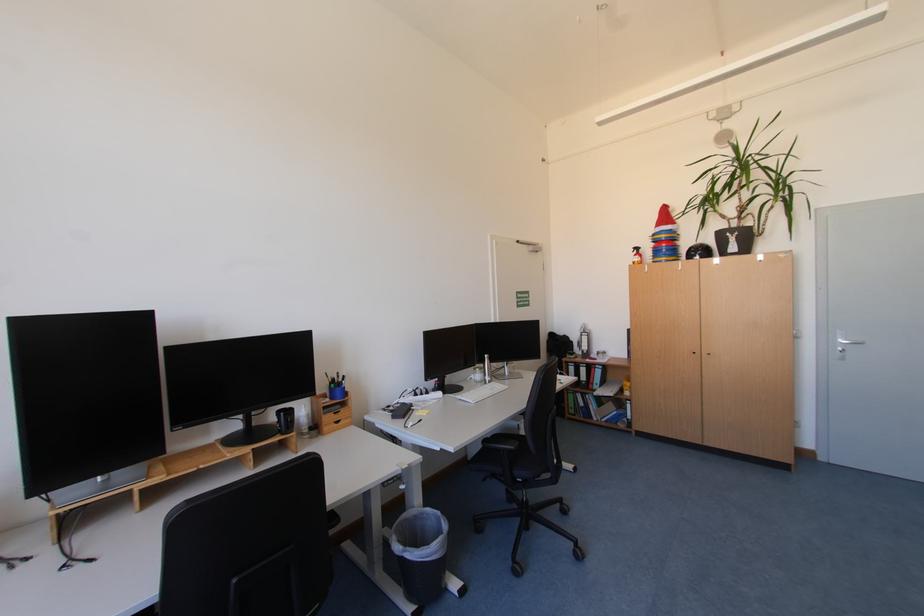
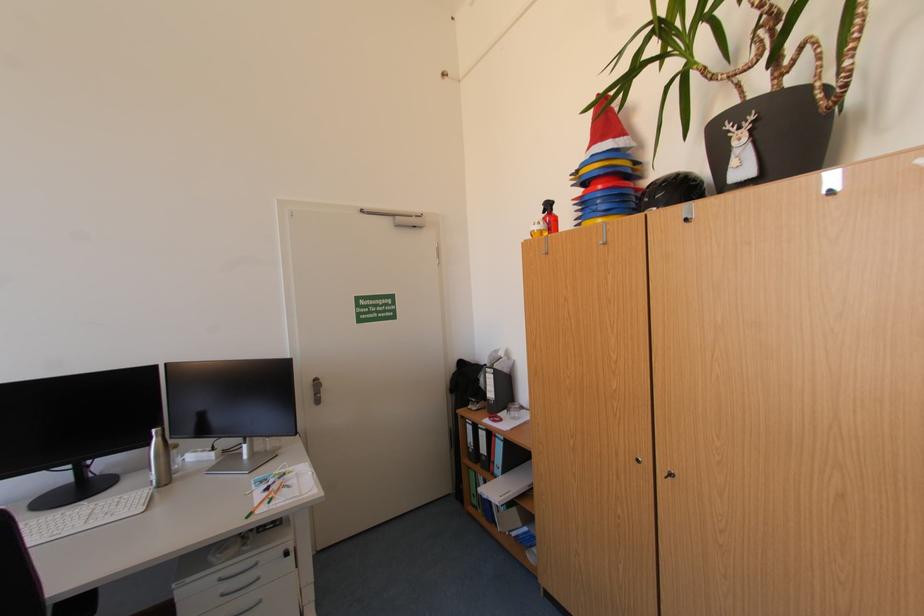
Question: I am providing you with two images of the same scene from different viewpoints. After the viewpoint changes to image2, which objects are now occluded?

Choices:
 (A) silver drawer handle
 (B) blue ring binder
 (C) stacked colorful cones
 (D) none of these

Answer: (D)